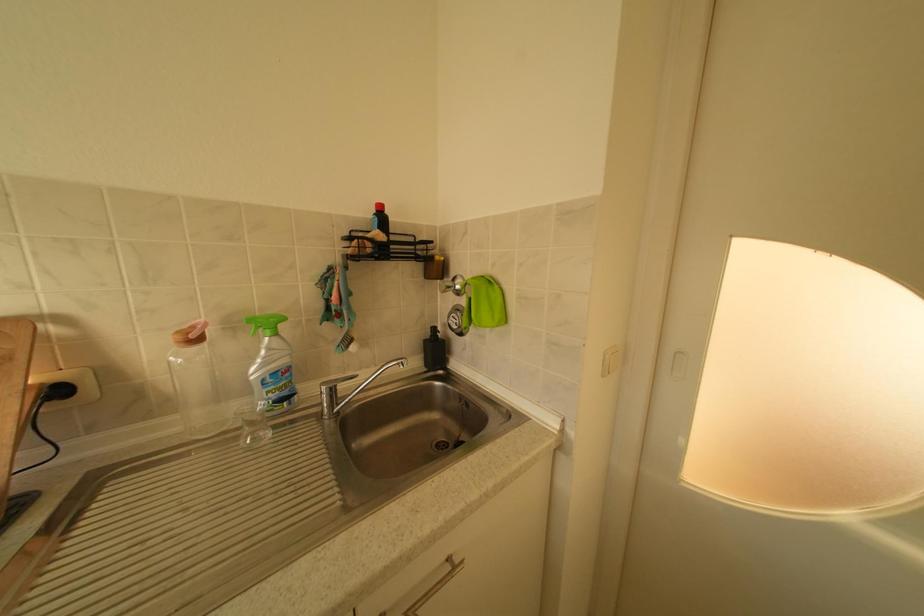
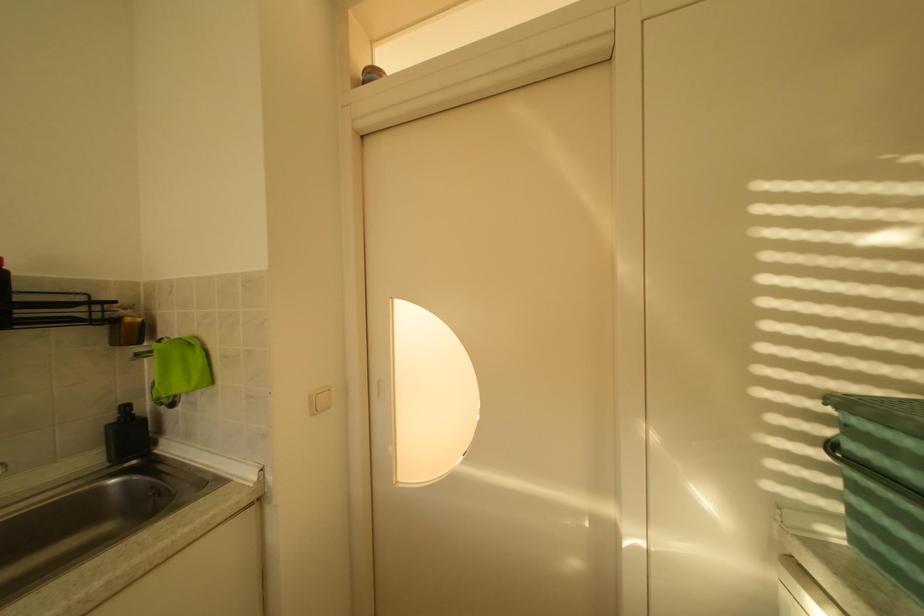
Question: The camera is either moving clockwise (left) or counter-clockwise (right) around the object. The first image is from the beginning of the video and the second image is from the end. Is the camera moving left or right when shooting the video?

Choices:
 (A) Left
 (B) Right

Answer: (A)